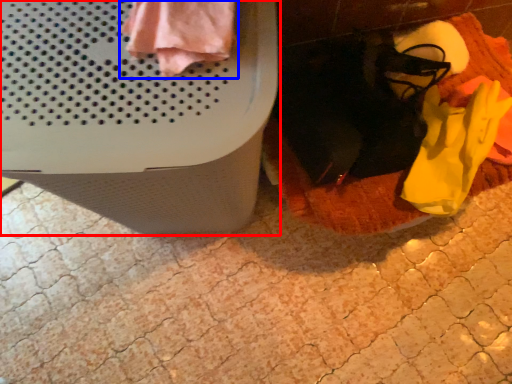
Question: Which object appears farthest to the camera in this image, waste container (highlighted by a red box) or clothing (highlighted by a blue box)?

Choices:
 (A) waste container
 (B) clothing

Answer: (B)